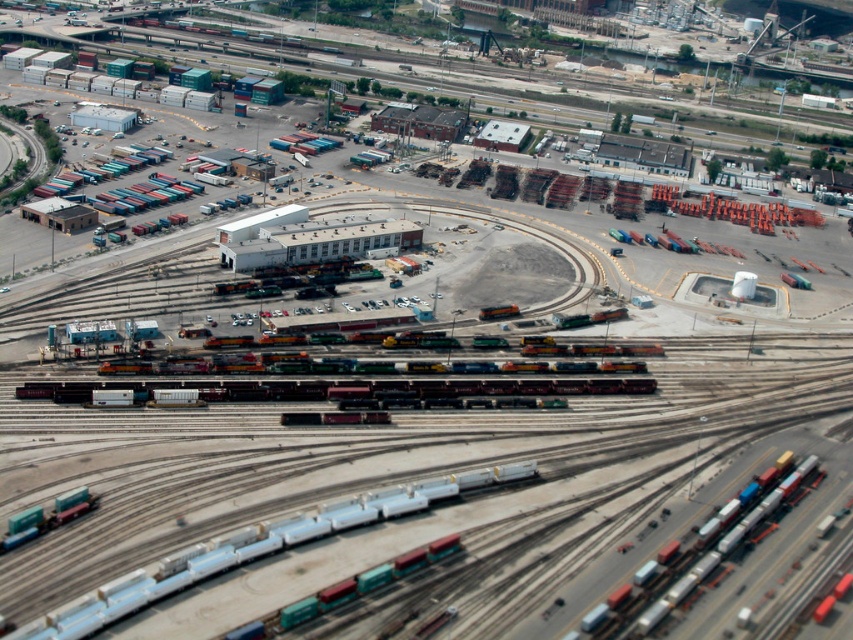
Which is in front, point (375, 499) or point (103, 372)?

Point (375, 499)

Can you confirm if metallic blue train car at bottom left is positioned to the left of shiny metallic train at center?

Correct, you'll find metallic blue train car at bottom left to the left of shiny metallic train at center.

I want to click on metallic blue train car at bottom left, so click(x=254, y=548).

Can you confirm if metallic blue train car at bottom left is wider than green matte train car at lower left?

Yes.

Looking at this image, does metallic blue train car at bottom left have a lesser height compared to green matte train car at lower left?

No.

Does point (207, 577) lie behind point (13, 525)?

No, it is not.

At what (x,y) coordinates should I click in order to perform the action: click on metallic blue train car at bottom left. Please return your answer as a coordinate pair (x, y). Image resolution: width=853 pixels, height=640 pixels. Looking at the image, I should click on (254, 548).

Does metallic freight train tracks at center have a lesser height compared to green matte train car at lower left?

Incorrect, metallic freight train tracks at center's height does not fall short of green matte train car at lower left's.

Can you confirm if metallic freight train tracks at center is thinner than green matte train car at lower left?

No, metallic freight train tracks at center is not thinner than green matte train car at lower left.

This screenshot has width=853, height=640. I want to click on metallic freight train tracks at center, so click(379, 452).